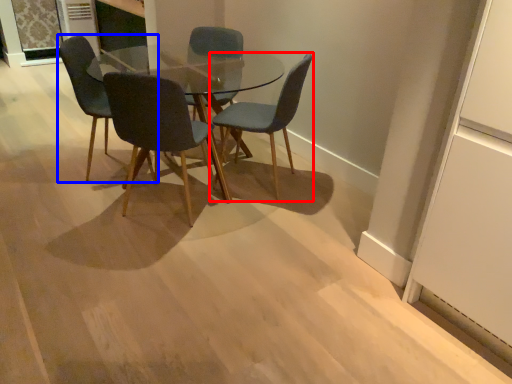
Question: Which point is further to the camera, chair (highlighted by a red box) or chair (highlighted by a blue box)?

Choices:
 (A) chair
 (B) chair

Answer: (B)